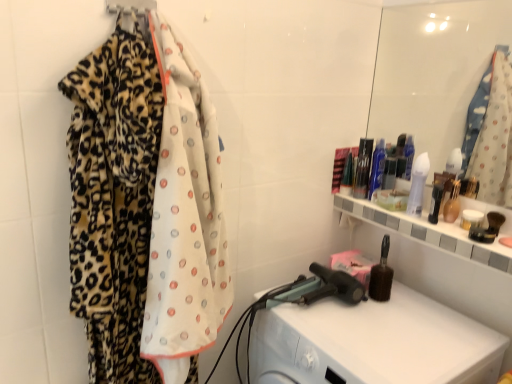
At what (x,y) coordinates should I click in order to perform the action: click on vacant space to the right of brown wooden brush at lower right, which is the third toiletry in left-to-right order. Please return your answer as a coordinate pair (x, y). Looking at the image, I should click on (421, 308).